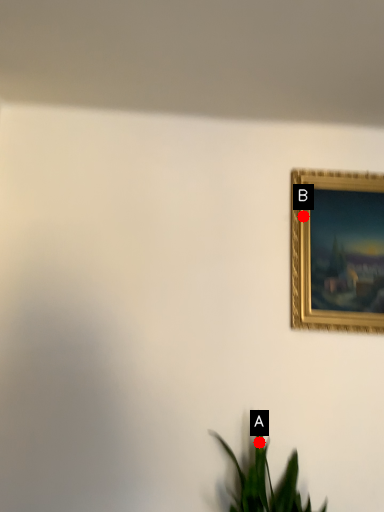
Question: Two points are circled on the image, labeled by A and B beside each circle. Which point appears farthest from the camera in this image?

Choices:
 (A) A is further
 (B) B is further

Answer: (B)